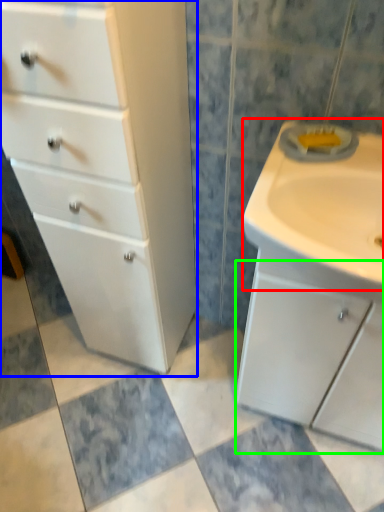
Question: Which object is the farthest from sink (highlighted by a red box)? Choose among these: chest of drawers (highlighted by a blue box) or cabinetry (highlighted by a green box).

Choices:
 (A) chest of drawers
 (B) cabinetry

Answer: (A)